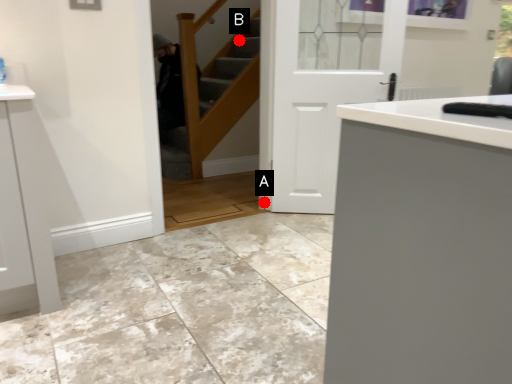
Question: Two points are circled on the image, labeled by A and B beside each circle. Which point is closer to the camera?

Choices:
 (A) A is closer
 (B) B is closer

Answer: (A)